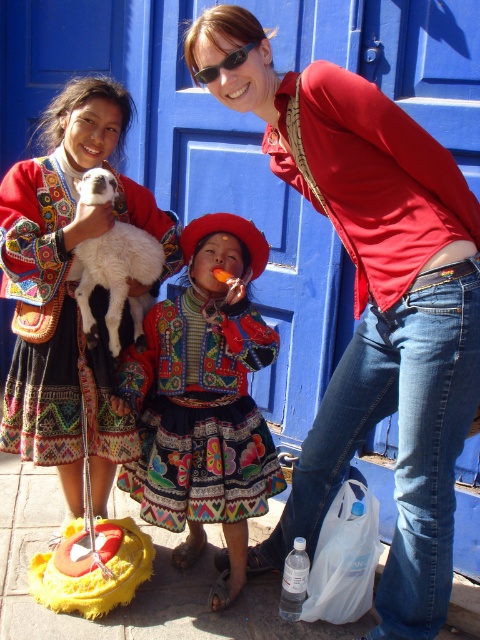
You are a photographer trying to capture a clear shot of the embroidered fabric dress at center and the black plastic sunglasses at upper center. Which object should you focus on first to ensure it appears sharp in the photo?

The embroidered fabric dress at center is closer to the viewer than the black plastic sunglasses at upper center, so you should focus on the embroidered fabric dress at center first to ensure it appears sharp.

You are a photographer setting up a tripod to take a portrait of the two girls in the scene. The embroidered fabric dress at center and the black plastic sunglasses at upper center are both in your frame. Which object should you focus on first if you want to capture both subjects clearly?

The embroidered fabric dress at center is located below the black plastic sunglasses at upper center, so you should focus on the black plastic sunglasses at upper center first to ensure both are in focus.